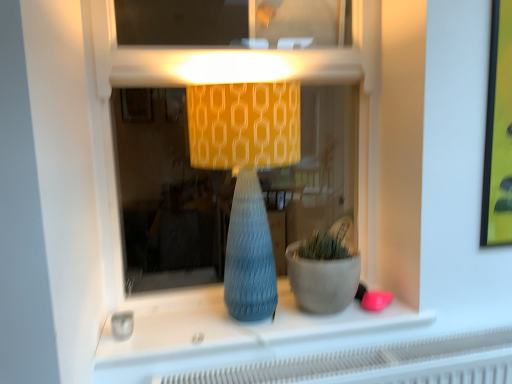
Question: Do you think matte concrete flowerpot at center is within matte gray vase at center, or outside of it?

Choices:
 (A) outside
 (B) inside

Answer: (A)

Question: Is point (330, 266) positioned closer to the camera than point (359, 319)?

Choices:
 (A) closer
 (B) farther

Answer: (A)

Question: Estimate the real-world distances between objects in this image. Which object is farther from the matte blue vase at center?

Choices:
 (A) matte yellow fabric lampshade at center
 (B) matte gray vase at center
 (C) matte concrete flowerpot at center

Answer: (B)

Question: Which object is positioned closest to the matte blue vase at center?

Choices:
 (A) matte concrete flowerpot at center
 (B) matte yellow fabric lampshade at center
 (C) matte gray vase at center

Answer: (B)